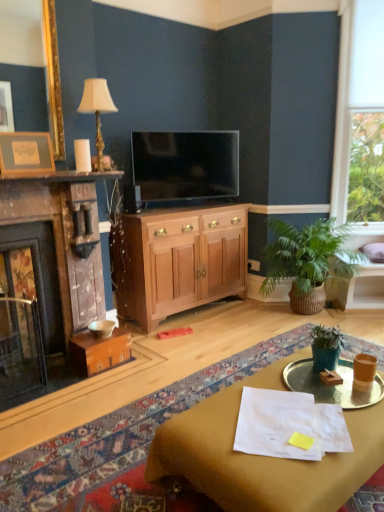
Where is `vacant space underneath green woven basket at right, the 1th houseplant positioned from the back (from a real-world perspective)`? The height and width of the screenshot is (512, 384). vacant space underneath green woven basket at right, the 1th houseplant positioned from the back (from a real-world perspective) is located at coordinates (306, 318).